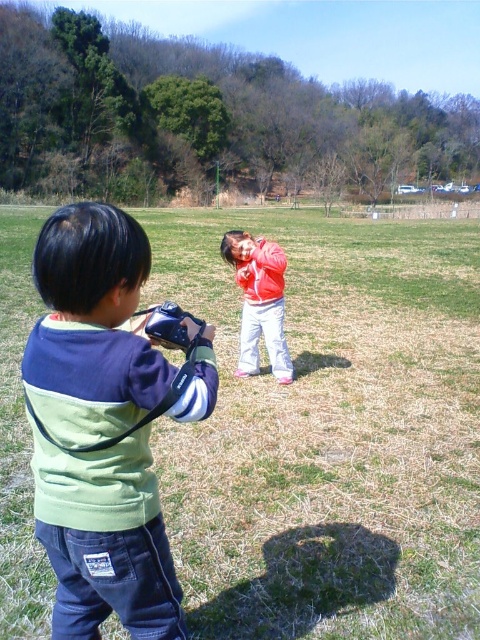
Between matte blue-green hoodie at left and matte red jacket at center, which one appears on the right side from the viewer's perspective?

matte red jacket at center

Who is shorter, matte blue-green hoodie at left or matte red jacket at center?

matte red jacket at center

Which is in front, point (50, 388) or point (271, 273)?

Point (50, 388) is in front.

You are a GUI agent. You are given a task and a screenshot of the screen. Output one action in this format:
    pyautogui.click(x=<x>, y=<y>)
    Task: Click on the matte blue-green hoodie at left
    The height and width of the screenshot is (640, 480).
    Given the screenshot: What is the action you would take?
    pyautogui.click(x=105, y=424)

Between point (453, 509) and point (137, 536), which one is positioned in front?

Point (137, 536) is more forward.

Where is `green grass at center`? The width and height of the screenshot is (480, 640). green grass at center is located at coordinates (330, 433).

Is green grass at center taller than matte red jacket at center?

Correct, green grass at center is much taller as matte red jacket at center.

Is green grass at center thinner than matte red jacket at center?

In fact, green grass at center might be wider than matte red jacket at center.

Identify the location of green grass at center. The height and width of the screenshot is (640, 480). (330, 433).